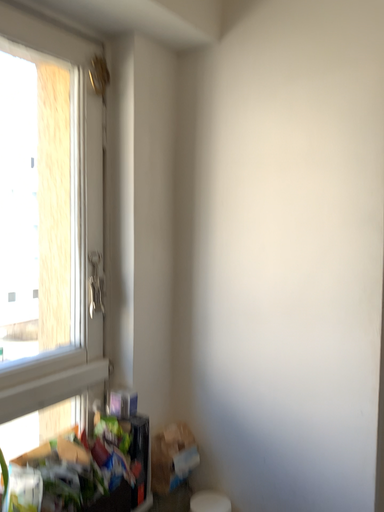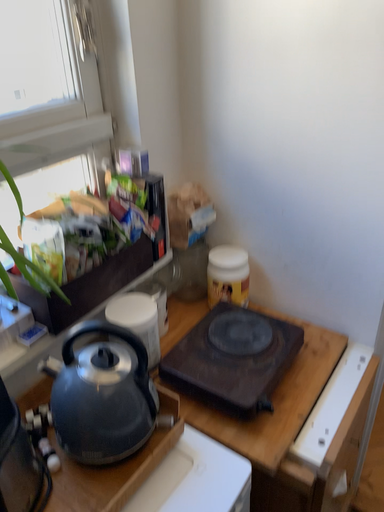
Question: Which way did the camera rotate in the video?

Choices:
 (A) rotated downward
 (B) rotated upward

Answer: (A)